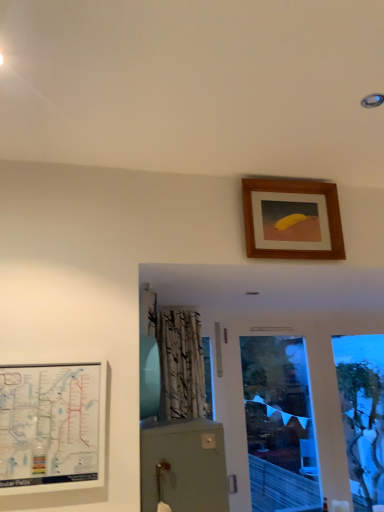
Question: From a real-world perspective, is white matte subway map at lower left, placed as the 1th picture frame when sorted from front to back, positioned above or below wooden picture frame at upper center, acting as the first picture frame starting from the top?

Choices:
 (A) above
 (B) below

Answer: (B)

Question: Relative to wooden picture frame at upper center, marked as the second picture frame in a front-to-back arrangement, is white matte subway map at lower left, arranged as the second picture frame when viewed from the top, in front or behind?

Choices:
 (A) behind
 (B) front

Answer: (B)

Question: From their relative heights in the image, would you say white matte subway map at lower left, the 1th picture frame ordered from the bottom, is taller or shorter than wooden picture frame at upper center, placed as the 2th picture frame when sorted from left to right?

Choices:
 (A) short
 (B) tall

Answer: (B)

Question: Visually, is wooden picture frame at upper center, which is the 1th picture frame in back-to-front order, positioned to the left or to the right of white matte subway map at lower left, placed as the 1th picture frame when sorted from front to back?

Choices:
 (A) left
 (B) right

Answer: (B)

Question: In the image, is wooden picture frame at upper center, placed as the 2th picture frame when sorted from left to right, positioned in front of or behind white matte subway map at lower left, placed as the 1th picture frame when sorted from front to back?

Choices:
 (A) front
 (B) behind

Answer: (B)

Question: Is point (248, 254) closer or farther from the camera than point (11, 367)?

Choices:
 (A) closer
 (B) farther

Answer: (B)

Question: Is wooden picture frame at upper center, marked as the second picture frame in a front-to-back arrangement, situated inside white matte subway map at lower left, arranged as the second picture frame when viewed from the top, or outside?

Choices:
 (A) inside
 (B) outside

Answer: (B)